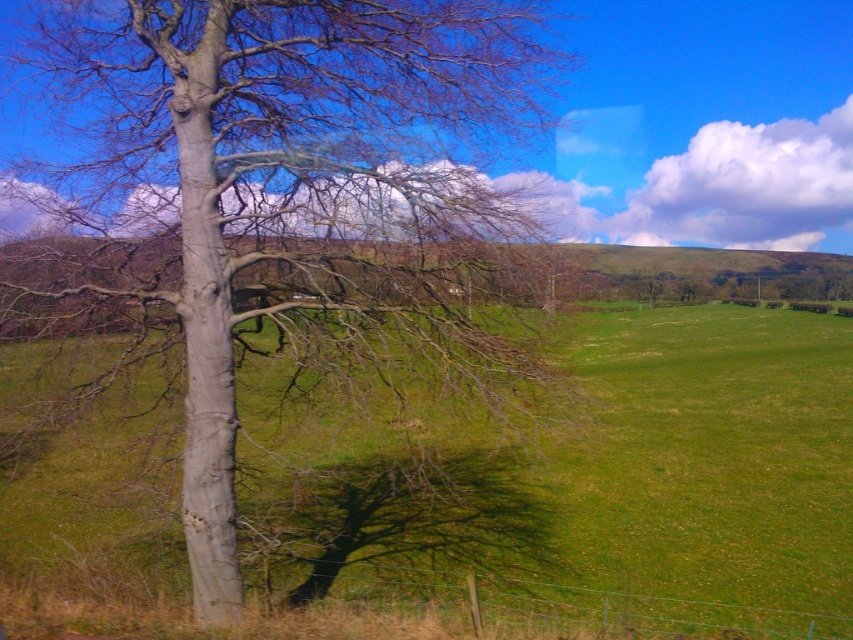
You are standing in the middle of the green grassy field at left and want to walk towards the smooth gray tree at left. Which direction should you head?

The smooth gray tree at left is positioned over the green grassy field at left, so you should head towards the left direction to reach it.

You are a painter standing in the middle of the green grassy field at left, and you want to paint the smooth gray tree at left. Which object will occupy more space on your canvas? Please explain your reasoning based on their sizes.

The green grassy field at left occupies more space on the canvas because the smooth gray tree at left has a lesser width compared to it.